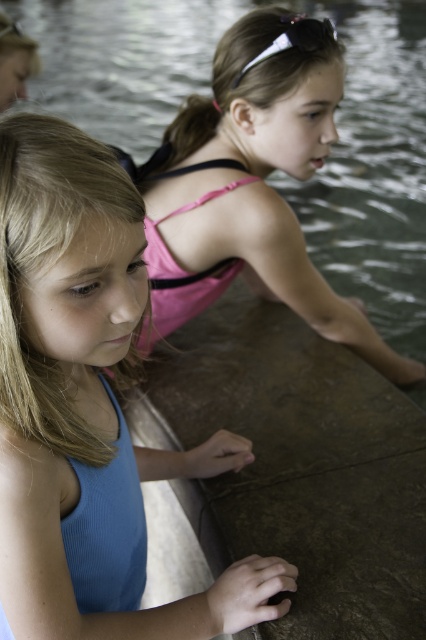
Between blue fabric swimsuit at left and pink fabric swimsuit at upper center, which one is positioned higher?

Positioned higher is pink fabric swimsuit at upper center.

Does point (94, 188) lie in front of point (294, 32)?

Yes, point (94, 188) is in front of point (294, 32).

What do you see at coordinates (88, 406) in the screenshot?
I see `blue fabric swimsuit at left` at bounding box center [88, 406].

Find the location of `blue fabric swimsuit at left`. blue fabric swimsuit at left is located at coordinates (88, 406).